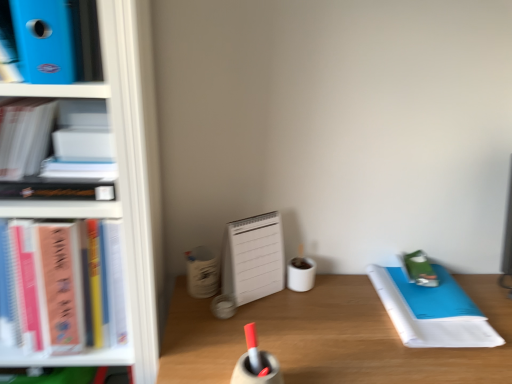
The height and width of the screenshot is (384, 512). What do you see at coordinates (62, 294) in the screenshot? I see `pink matte notebook at left, arranged as the 1th book when ordered from the bottom` at bounding box center [62, 294].

Measure the distance between pink matte notebook at left, arranged as the 1th book when ordered from the bottom, and camera.

30.31 inches.

The width and height of the screenshot is (512, 384). I want to click on wooden desk at center, so click(x=329, y=337).

In order to click on green matte notebook at right in this screenshot , I will do `click(420, 269)`.

Describe the element at coordinates (55, 35) in the screenshot. The width and height of the screenshot is (512, 384). I see `blue plastic folder at upper left, the third book positioned from the bottom` at that location.

What do you see at coordinates (52, 134) in the screenshot?
I see `white matte book at upper left, which appears as the second book when ordered from the bottom` at bounding box center [52, 134].

Identify the location of white paper notebook at right. (432, 311).

I want to click on white plastic bookcase at left, so click(118, 182).

What are the coordinates of `notebook below the pink matte notebook at left, arranged as the 1th book when ordered from the bottom (from the image's perspective)` in the screenshot? It's located at click(x=432, y=311).

Considering the relative sizes of white paper notebook at right and pink matte notebook at left, placed as the third book when sorted from top to bottom, in the image provided, is white paper notebook at right taller than pink matte notebook at left, placed as the third book when sorted from top to bottom,?

Incorrect, the height of white paper notebook at right is not larger of that of pink matte notebook at left, placed as the third book when sorted from top to bottom.

From the image's perspective, between white paper notebook at right and pink matte notebook at left, arranged as the 1th book when ordered from the bottom, who is located below?

white paper notebook at right, from the image's perspective.

Considering the sizes of white paper notebook at right and pink matte notebook at left, placed as the third book when sorted from top to bottom, in the image, is white paper notebook at right bigger or smaller than pink matte notebook at left, placed as the third book when sorted from top to bottom,?

white paper notebook at right is smaller than pink matte notebook at left, placed as the third book when sorted from top to bottom.

From a real-world perspective, does blue plastic folder at upper left, placed as the 1th book when sorted from top to bottom, sit lower than pink matte notebook at left, placed as the third book when sorted from top to bottom?

No, from a real-world perspective, blue plastic folder at upper left, placed as the 1th book when sorted from top to bottom, is not below pink matte notebook at left, placed as the third book when sorted from top to bottom.

Between blue plastic folder at upper left, placed as the 1th book when sorted from top to bottom, and pink matte notebook at left, placed as the third book when sorted from top to bottom, which one appears on the left side from the viewer's perspective?

From the viewer's perspective, pink matte notebook at left, placed as the third book when sorted from top to bottom, appears more on the left side.

Where is `the 2nd book below the blue plastic folder at upper left, the third book positioned from the bottom (from the image's perspective)`? the 2nd book below the blue plastic folder at upper left, the third book positioned from the bottom (from the image's perspective) is located at coordinates pos(62,294).

From the picture: Is blue plastic folder at upper left, the third book positioned from the bottom, wider than pink matte notebook at left, placed as the third book when sorted from top to bottom?

No, blue plastic folder at upper left, the third book positioned from the bottom, is not wider than pink matte notebook at left, placed as the third book when sorted from top to bottom.

Is pink matte notebook at left, arranged as the 1th book when ordered from the bottom, positioned with its back to wooden desk at center?

That's not correct — pink matte notebook at left, arranged as the 1th book when ordered from the bottom, is not looking away from wooden desk at center.

How much distance is there between pink matte notebook at left, arranged as the 1th book when ordered from the bottom, and wooden desk at center?

pink matte notebook at left, arranged as the 1th book when ordered from the bottom, is 12.99 inches from wooden desk at center.

Would you consider pink matte notebook at left, arranged as the 1th book when ordered from the bottom, to be distant from wooden desk at center?

No, there isn't a large distance between pink matte notebook at left, arranged as the 1th book when ordered from the bottom, and wooden desk at center.

From the image's perspective, does pink matte notebook at left, arranged as the 1th book when ordered from the bottom, appear lower than wooden desk at center?

No.

Are blue plastic folder at upper left, placed as the 1th book when sorted from top to bottom, and white plastic bookcase at left making contact?

No, blue plastic folder at upper left, placed as the 1th book when sorted from top to bottom, is not making contact with white plastic bookcase at left.

Can you confirm if blue plastic folder at upper left, placed as the 1th book when sorted from top to bottom, is smaller than white plastic bookcase at left?

Correct, blue plastic folder at upper left, placed as the 1th book when sorted from top to bottom, occupies less space than white plastic bookcase at left.

Is blue plastic folder at upper left, the third book positioned from the bottom, surrounding white plastic bookcase at left?

No, white plastic bookcase at left is located outside of blue plastic folder at upper left, the third book positioned from the bottom.

Where is `the 3rd book above the white paper notebook at right (from the image's perspective)`? the 3rd book above the white paper notebook at right (from the image's perspective) is located at coordinates (55, 35).

From a real-world perspective, between white paper notebook at right and blue plastic folder at upper left, placed as the 1th book when sorted from top to bottom, who is vertically higher?

blue plastic folder at upper left, placed as the 1th book when sorted from top to bottom, is physically above.

Is white paper notebook at right oriented away from blue plastic folder at upper left, the third book positioned from the bottom?

That's not correct — white paper notebook at right is not looking away from blue plastic folder at upper left, the third book positioned from the bottom.

Which object is more forward, pink matte notebook at left, arranged as the 1th book when ordered from the bottom, or white matte book at upper left, which appears as the second book when ordered from the bottom?

white matte book at upper left, which appears as the second book when ordered from the bottom, is more forward.

Is pink matte notebook at left, placed as the third book when sorted from top to bottom, positioned with its back to white matte book at upper left, the second book positioned from the top?

No, white matte book at upper left, the second book positioned from the top, is not at the back of pink matte notebook at left, placed as the third book when sorted from top to bottom.

From the picture: From their relative heights in the image, would you say pink matte notebook at left, placed as the third book when sorted from top to bottom, is taller or shorter than white matte book at upper left, which appears as the second book when ordered from the bottom?

Clearly, pink matte notebook at left, placed as the third book when sorted from top to bottom, is taller compared to white matte book at upper left, which appears as the second book when ordered from the bottom.

Considering the relative sizes of pink matte notebook at left, placed as the third book when sorted from top to bottom, and white matte book at upper left, the second book positioned from the top, in the image provided, is pink matte notebook at left, placed as the third book when sorted from top to bottom, smaller than white matte book at upper left, the second book positioned from the top,?

No, pink matte notebook at left, placed as the third book when sorted from top to bottom, is not smaller than white matte book at upper left, the second book positioned from the top.

Looking at this image, can you confirm if white plastic bookcase at left is smaller than white paper notebook at right?

No.

In the image, is white plastic bookcase at left positioned in front of or behind white paper notebook at right?

Clearly, white plastic bookcase at left is in front of white paper notebook at right.

Is point (44, 213) closer to camera compared to point (446, 310)?

Yes, it is.

In the scene shown: Between white plastic bookcase at left and white paper notebook at right, which one has smaller width?

white paper notebook at right is thinner.

Image resolution: width=512 pixels, height=384 pixels. I want to click on notebook behind the pink matte notebook at left, placed as the third book when sorted from top to bottom, so click(x=432, y=311).

Find the location of a particular element. Image resolution: width=512 pixels, height=384 pixels. the 2nd book in front of the pink matte notebook at left, arranged as the 1th book when ordered from the bottom is located at coordinates (55, 35).

Based on their spatial positions, is white paper notebook at right or pink matte notebook at left, arranged as the 1th book when ordered from the bottom, further from green matte notebook at right?

pink matte notebook at left, arranged as the 1th book when ordered from the bottom, is further to green matte notebook at right.

Looking at the image, which one is located closer to white paper notebook at right, blue plastic folder at upper left, placed as the 1th book when sorted from top to bottom, or white plastic bookcase at left?

white plastic bookcase at left lies closer to white paper notebook at right than the other object.

Considering their positions, is pink matte notebook at left, placed as the third book when sorted from top to bottom, positioned closer to white plastic bookcase at left than wooden desk at center?

pink matte notebook at left, placed as the third book when sorted from top to bottom, is closer to white plastic bookcase at left.

From the image, which object appears to be farther from white matte book at upper left, the second book positioned from the top, blue plastic folder at upper left, placed as the 1th book when sorted from top to bottom, or green matte notebook at right?

The object further to white matte book at upper left, the second book positioned from the top, is green matte notebook at right.

When comparing their distances from pink matte notebook at left, placed as the third book when sorted from top to bottom, does white paper notebook at right or wooden desk at center seem closer?

wooden desk at center lies closer to pink matte notebook at left, placed as the third book when sorted from top to bottom, than the other object.

Based on their spatial positions, is green matte notebook at right or white matte book at upper left, which appears as the second book when ordered from the bottom, further from blue plastic folder at upper left, placed as the 1th book when sorted from top to bottom?

Among the two, green matte notebook at right is located further to blue plastic folder at upper left, placed as the 1th book when sorted from top to bottom.

Which object lies further to the anchor point pink matte notebook at left, arranged as the 1th book when ordered from the bottom, green matte notebook at right or wooden desk at center?

green matte notebook at right is further to pink matte notebook at left, arranged as the 1th book when ordered from the bottom.

When comparing their distances from wooden desk at center, does blue plastic folder at upper left, placed as the 1th book when sorted from top to bottom, or green matte notebook at right seem closer?

The object closer to wooden desk at center is green matte notebook at right.

The image size is (512, 384). I want to click on book situated between pink matte notebook at left, placed as the third book when sorted from top to bottom, and green matte notebook at right from left to right, so click(55, 35).

You are a GUI agent. You are given a task and a screenshot of the screen. Output one action in this format:
    pyautogui.click(x=<x>, y=<y>)
    Task: Click on the bookcase located between white matte book at upper left, which appears as the second book when ordered from the bottom, and green matte notebook at right in the left-right direction
    The width and height of the screenshot is (512, 384).
    Given the screenshot: What is the action you would take?
    pyautogui.click(x=118, y=182)

This screenshot has width=512, height=384. I want to click on book located between pink matte notebook at left, placed as the third book when sorted from top to bottom, and wooden desk at center in the left-right direction, so click(55, 35).

Find the location of a particular element. This screenshot has height=384, width=512. desk located between blue plastic folder at upper left, placed as the 1th book when sorted from top to bottom, and green matte notebook at right in the left-right direction is located at coordinates coord(329,337).